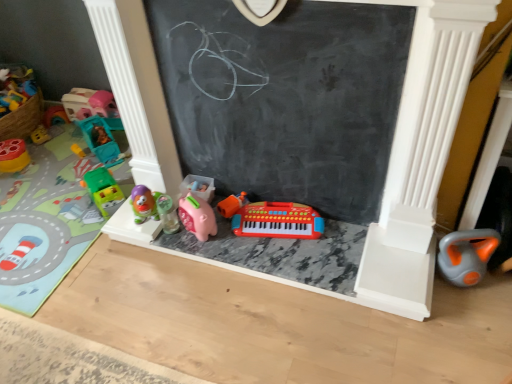
Question: From the image's perspective, is green plastic toy car at left, the 7th toy positioned from the right, below green plastic toy car at left, which is the 4th toy from right to left?

Choices:
 (A) no
 (B) yes

Answer: (A)

Question: Could green plastic toy car at left, which is the 4th toy from right to left, be considered to be inside green plastic toy car at left, the 7th toy positioned from the right?

Choices:
 (A) no
 (B) yes

Answer: (A)

Question: Is green plastic toy car at left, the 7th toy positioned from the right, placed right next to green plastic toy car at left, the 5th toy in the left-to-right sequence?

Choices:
 (A) no
 (B) yes

Answer: (A)

Question: Considering the relative sizes of green plastic toy car at left, the 7th toy positioned from the right, and green plastic toy car at left, the 5th toy in the left-to-right sequence, in the image provided, is green plastic toy car at left, the 7th toy positioned from the right, thinner than green plastic toy car at left, the 5th toy in the left-to-right sequence,?

Choices:
 (A) yes
 (B) no

Answer: (B)

Question: Considering the relative positions of green plastic toy car at left, positioned as the second toy in left-to-right order, and green plastic toy car at left, which is the 4th toy from right to left, in the image provided, is green plastic toy car at left, positioned as the second toy in left-to-right order, in front of green plastic toy car at left, which is the 4th toy from right to left,?

Choices:
 (A) no
 (B) yes

Answer: (B)

Question: Based on their sizes in the image, would you say black chalkboard at center is bigger or smaller than green plastic toy car at left, the 5th toy in the left-to-right sequence?

Choices:
 (A) small
 (B) big

Answer: (B)

Question: Is black chalkboard at center in front of or behind green plastic toy car at left, which is the 4th toy from right to left, in the image?

Choices:
 (A) behind
 (B) front

Answer: (B)

Question: Is point (335, 31) closer or farther from the camera than point (99, 192)?

Choices:
 (A) farther
 (B) closer

Answer: (B)

Question: From the image's perspective, is black chalkboard at center positioned above or below green plastic toy car at left, which is the 4th toy from right to left?

Choices:
 (A) below
 (B) above

Answer: (B)

Question: In terms of height, does green plastic toy car at left, the 7th toy positioned from the right, look taller or shorter compared to matte yellow and red toy at left, arranged as the 8th toy when viewed from the right?

Choices:
 (A) tall
 (B) short

Answer: (B)

Question: Considering their positions, is green plastic toy car at left, positioned as the second toy in left-to-right order, located in front of or behind matte yellow and red toy at left, the 1th toy from the left?

Choices:
 (A) behind
 (B) front

Answer: (B)

Question: Considering the relative positions of green plastic toy car at left, the 7th toy positioned from the right, and matte yellow and red toy at left, arranged as the 8th toy when viewed from the right, in the image provided, is green plastic toy car at left, the 7th toy positioned from the right, to the left or to the right of matte yellow and red toy at left, arranged as the 8th toy when viewed from the right,?

Choices:
 (A) left
 (B) right

Answer: (B)

Question: Looking at their shapes, would you say green plastic toy car at left, positioned as the second toy in left-to-right order, is wider or thinner than matte yellow and red toy at left, the 1th toy from the left?

Choices:
 (A) wide
 (B) thin

Answer: (A)

Question: Considering the relative positions of translucent plastic toy car at left, which is the fourth toy in left-to-right order, and green plastic toy car at left, the 7th toy positioned from the right, in the image provided, is translucent plastic toy car at left, which is the fourth toy in left-to-right order, to the left or to the right of green plastic toy car at left, the 7th toy positioned from the right,?

Choices:
 (A) right
 (B) left

Answer: (A)

Question: Considering the positions of point (91, 125) and point (23, 208), is point (91, 125) closer or farther from the camera than point (23, 208)?

Choices:
 (A) closer
 (B) farther

Answer: (B)